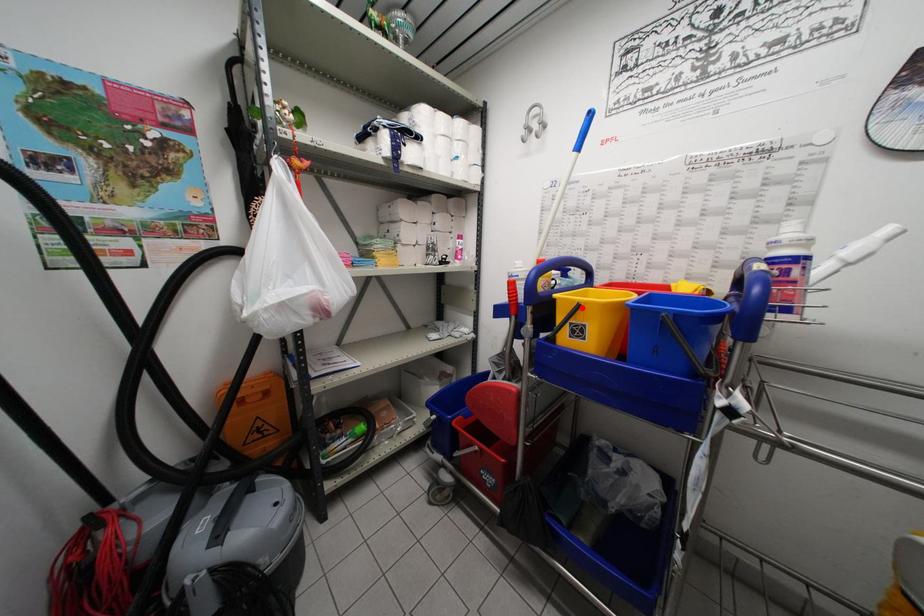
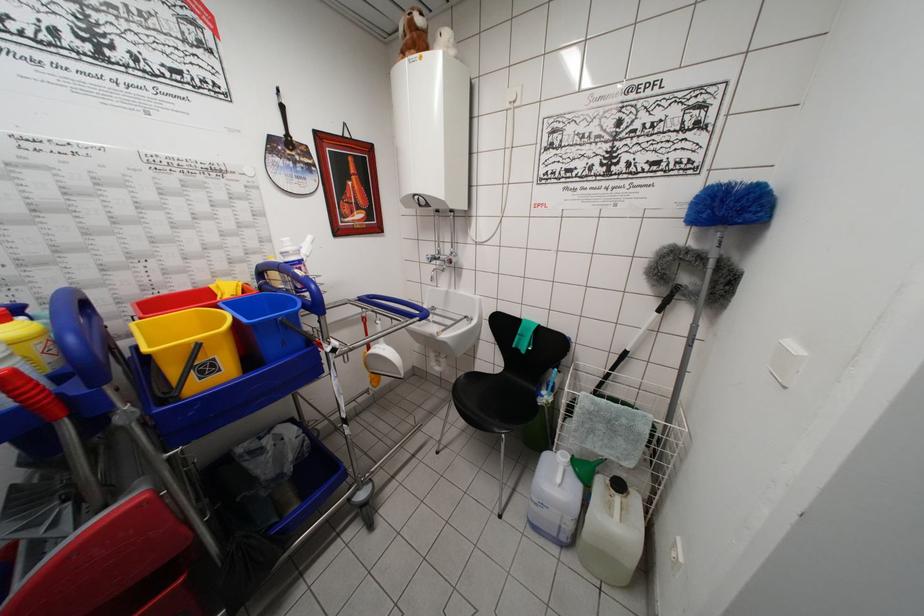
Find the pixel in the second image that matches the highlighted location in the first image.

(200, 349)